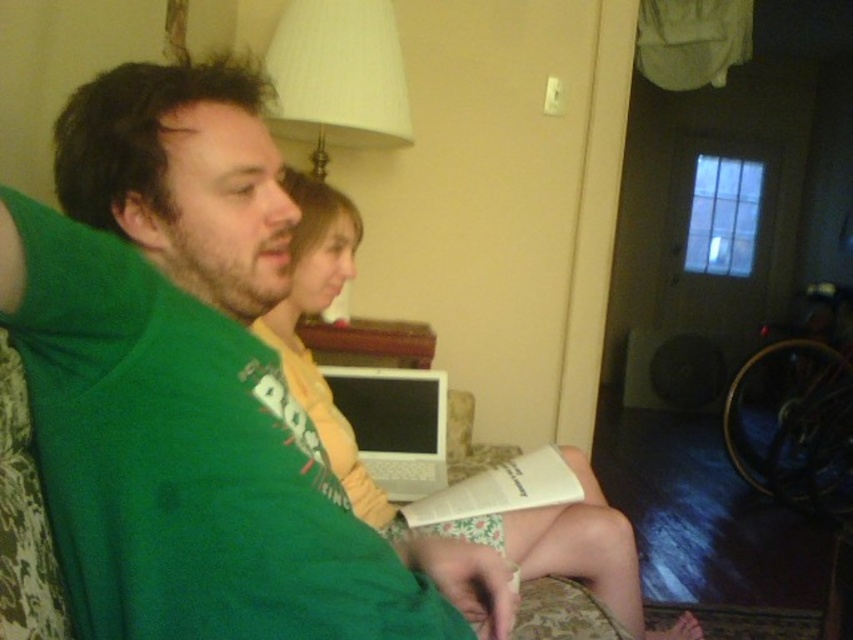
Can you confirm if yellow knit sweater at center is positioned below white paper book at center?

No, yellow knit sweater at center is not below white paper book at center.

Is yellow knit sweater at center smaller than white paper book at center?

Incorrect, yellow knit sweater at center is not smaller in size than white paper book at center.

What do you see at coordinates (314, 314) in the screenshot? The height and width of the screenshot is (640, 853). I see `yellow knit sweater at center` at bounding box center [314, 314].

The image size is (853, 640). I want to click on yellow knit sweater at center, so click(314, 314).

Is yellow knit sweater at center thinner than white fabric lampshade at upper center?

In fact, yellow knit sweater at center might be wider than white fabric lampshade at upper center.

This screenshot has height=640, width=853. Find the location of `yellow knit sweater at center`. yellow knit sweater at center is located at coordinates (314, 314).

This screenshot has width=853, height=640. I want to click on yellow knit sweater at center, so click(314, 314).

Which is in front, point (376, 122) or point (419, 481)?

Positioned in front is point (419, 481).

This screenshot has width=853, height=640. Identify the location of white fabric lampshade at upper center. (338, 76).